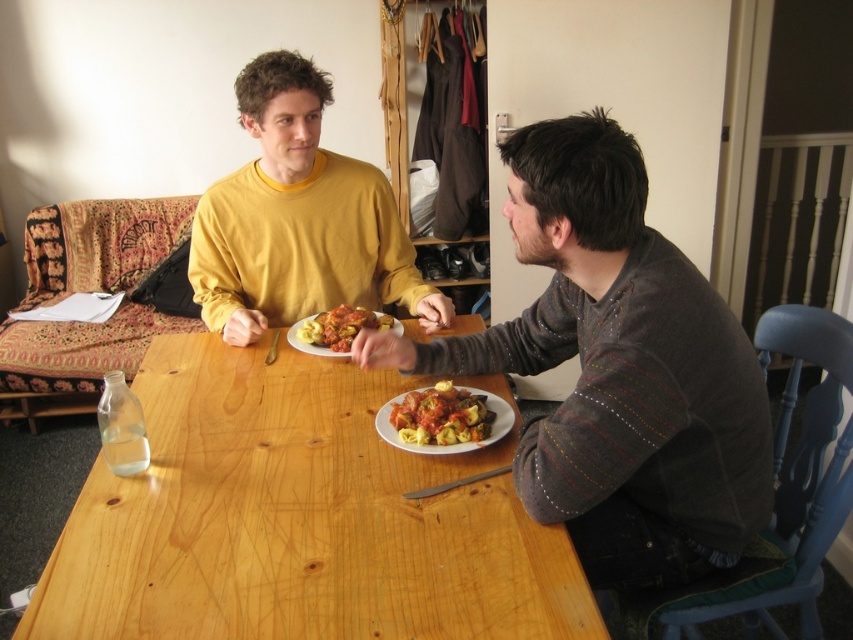
What is located at the coordinates point (299, 220) in the image?

The point (299, 220) is where the matte yellow sweater at center is located.

You are taking a photo of the dining table and want to focus on both the point at coordinates point (231, 227) and point (483, 394). Which point is closer to the camera?

Point (231, 227) is further to the camera than point (483, 394), so point (483, 394) is closer to the camera.

You are a food critic evaluating portion sizes for a review. You have two dishes in front of you, the matte tortellini at center and the matte tomato sauce pasta at center. Which dish has a smaller portion size?

The matte tortellini at center has a smaller size compared to the matte tomato sauce pasta at center, so the matte tortellini at center has the smaller portion size.